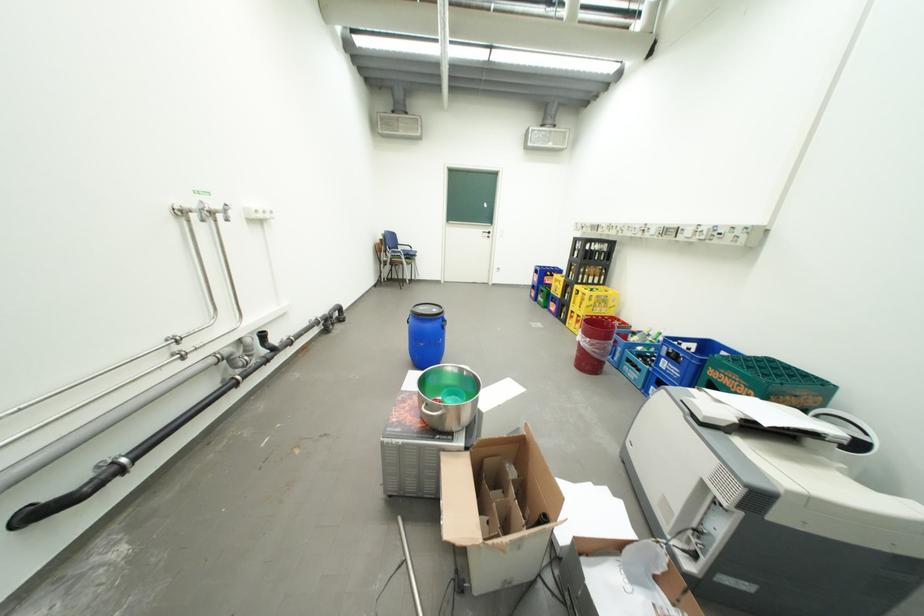
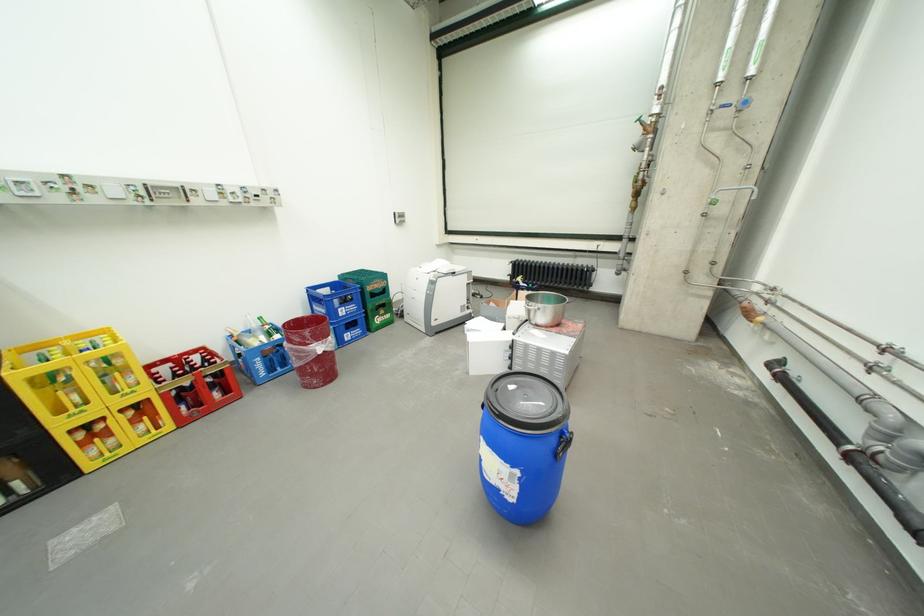
The point at [615,325] is marked in the first image. Where is the corresponding point in the second image?

(297, 328)